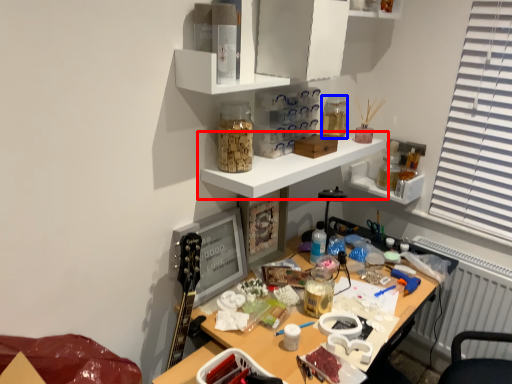
Question: Which object appears closest to the camera in this image, shelf (highlighted by a red box) or stationery (highlighted by a blue box)?

Choices:
 (A) shelf
 (B) stationery

Answer: (A)